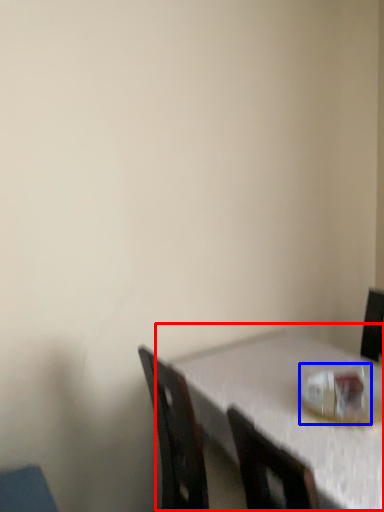
Question: Which object appears farthest to the camera in this image, table (highlighted by a red box) or tableware (highlighted by a blue box)?

Choices:
 (A) table
 (B) tableware

Answer: (B)